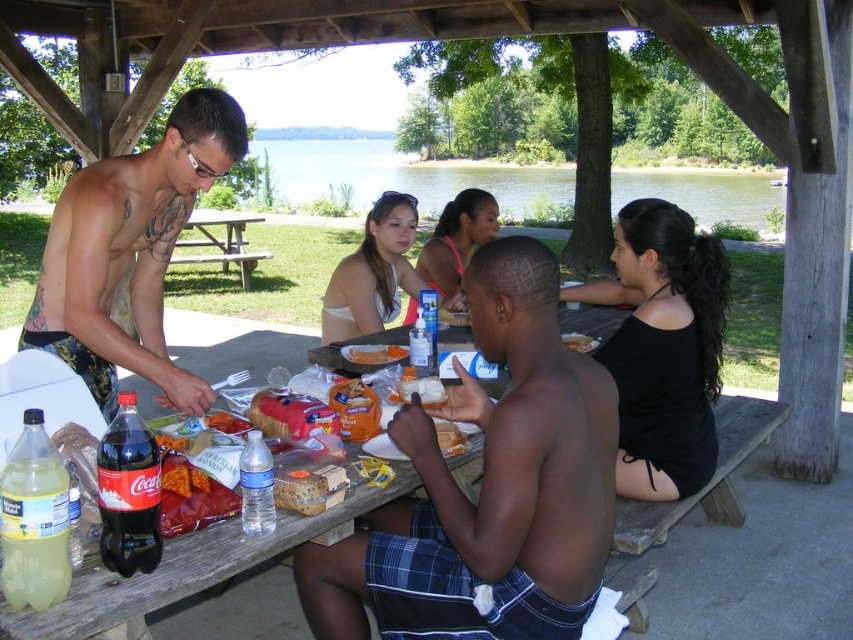
Question: Which point is closer to the camera?

Choices:
 (A) (173, 177)
 (B) (194, 221)
 (C) (451, 504)

Answer: (C)

Question: Considering the real-world distances, which object is farthest from the white fabric bikini top at center?

Choices:
 (A) wooden picnic table at center
 (B) shiny black shorts at center

Answer: (A)

Question: Is shiny black shorts at center to the right of orange bread at center from the viewer's perspective?

Choices:
 (A) yes
 (B) no

Answer: (A)

Question: Can you confirm if white fabric bikini top at center is bigger than matte pink tank top at center?

Choices:
 (A) no
 (B) yes

Answer: (A)

Question: Is green water at upper center wider than matte pink tank top at center?

Choices:
 (A) yes
 (B) no

Answer: (A)

Question: Which of the following is the farthest from the observer?

Choices:
 (A) wooden picnic table at center
 (B) shiny black shorts at center
 (C) matte pink tank top at center
 (D) green water at upper center

Answer: (D)